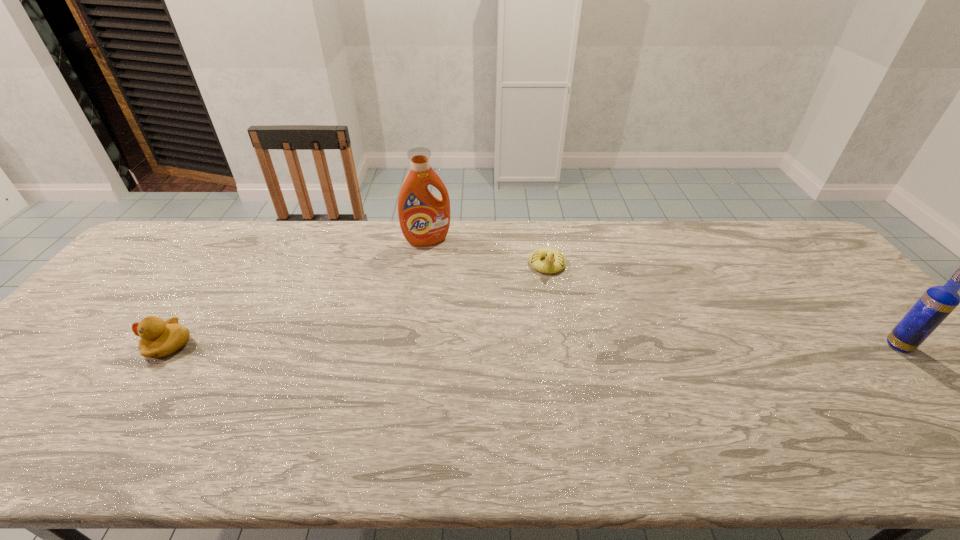
Find the location of a particular element. The height and width of the screenshot is (540, 960). object that is at the right edge is located at coordinates (934, 306).

At what (x,y) coordinates should I click in order to perform the action: click on vacant space at the far edge of the desktop. Please return your answer as a coordinate pair (x, y). This screenshot has height=540, width=960. Looking at the image, I should click on (684, 251).

What are the coordinates of `vacant space at the near edge of the desktop` in the screenshot? It's located at (149, 408).

What are the coordinates of `free space at the left edge of the desktop` in the screenshot? It's located at (35, 375).

Locate an element on the screen. vacant space at the right edge of the desktop is located at coordinates (832, 296).

At what (x,y) coordinates should I click in order to perform the action: click on free spot at the far left corner of the desktop. Please return your answer as a coordinate pair (x, y). Image resolution: width=960 pixels, height=540 pixels. Looking at the image, I should click on (160, 263).

Where is `vacant space at the far right corner of the desktop`? The height and width of the screenshot is (540, 960). vacant space at the far right corner of the desktop is located at coordinates (789, 220).

In order to click on free spot between the vodka and the right duckling in this screenshot , I will do `click(723, 305)`.

You are a GUI agent. You are given a task and a screenshot of the screen. Output one action in this format:
    pyautogui.click(x=<x>, y=<y>)
    Task: Click on the vacant region between the detergent and the third nearest object
    
    Given the screenshot: What is the action you would take?
    pyautogui.click(x=488, y=253)

Image resolution: width=960 pixels, height=540 pixels. Identify the location of free space that is in between the leftmost object and the vodka. (534, 345).